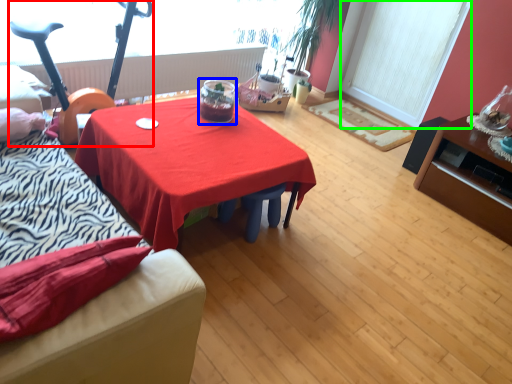
Question: Which is nearer to the baby carriage (highlighted by a red box)? glass jar (highlighted by a blue box) or window screen (highlighted by a green box).

Choices:
 (A) glass jar
 (B) window screen

Answer: (A)